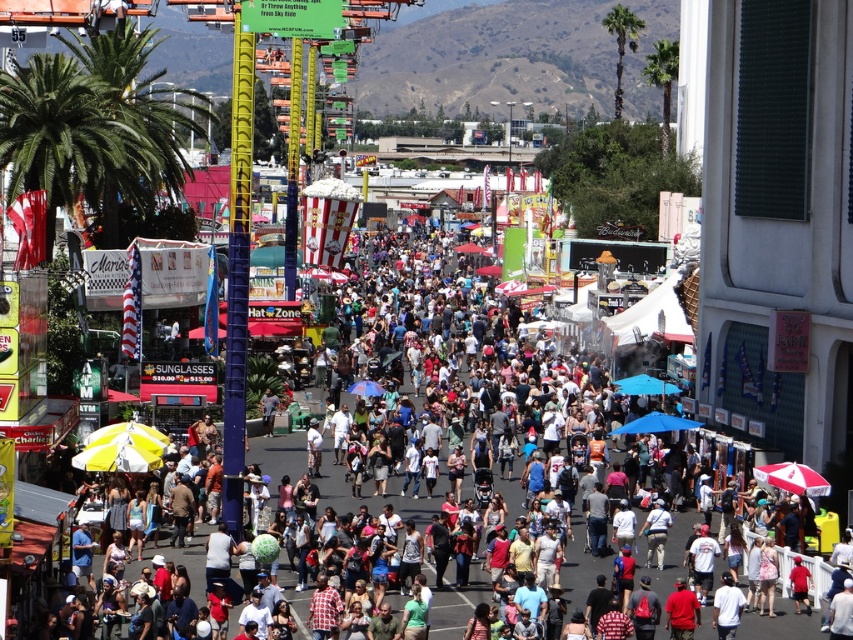
Is green leafy palm tree at left wider than green leafy palm tree at upper right?

No, green leafy palm tree at left is not wider than green leafy palm tree at upper right.

Is point (167, 145) positioned after point (636, 49)?

No, it is in front of (636, 49).

The image size is (853, 640). Find the location of `green leafy palm tree at left`. green leafy palm tree at left is located at coordinates (141, 125).

Can you confirm if green leafy palm tree at upper left is thinner than green leafy palm tree at left?

Correct, green leafy palm tree at upper left's width is less than green leafy palm tree at left's.

Which of these two, green leafy palm tree at upper left or green leafy palm tree at left, stands taller?

green leafy palm tree at left

Does point (120, 88) come closer to viewer compared to point (131, 188)?

No, (120, 88) is behind (131, 188).

This screenshot has width=853, height=640. I want to click on green leafy palm tree at upper left, so (x=73, y=136).

What are the coordinates of `green leafy palm tree at upper left` in the screenshot? It's located at (73, 136).

Where is `green leafy palm tree at upper left`? Image resolution: width=853 pixels, height=640 pixels. green leafy palm tree at upper left is located at coordinates (73, 136).